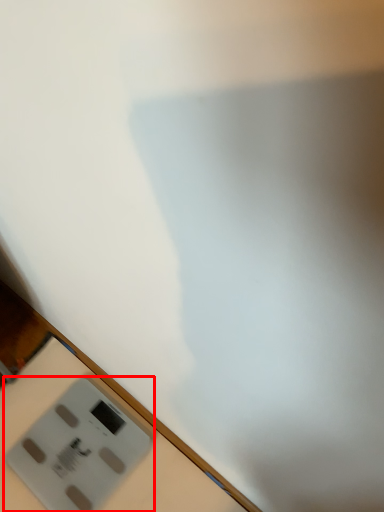
Question: In this image, where is power plugs and sockets (annotated by the red box) located relative to table?

Choices:
 (A) right
 (B) left

Answer: (B)